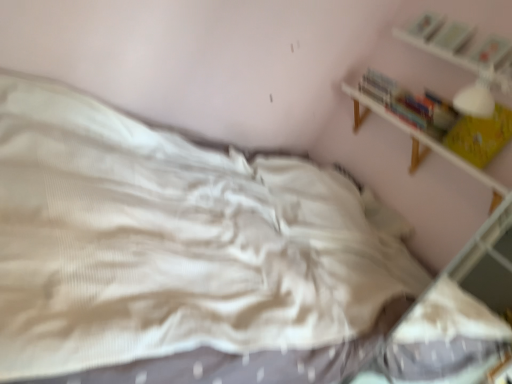
Question: From a real-world perspective, is yellow paper book at upper right, which is the fourth book in top-to-bottom order, under hardcover book at upper right, the second book when ordered from top to bottom?

Choices:
 (A) no
 (B) yes

Answer: (B)

Question: Is yellow paper book at upper right, positioned as the first book in bottom-to-top order, aimed at hardcover book at upper right, acting as the third book starting from the bottom?

Choices:
 (A) yes
 (B) no

Answer: (B)

Question: Is yellow paper book at upper right, positioned as the first book in bottom-to-top order, looking in the opposite direction of hardcover book at upper right, the second book when ordered from top to bottom?

Choices:
 (A) yes
 (B) no

Answer: (B)

Question: Is the depth of yellow paper book at upper right, which is the fourth book in top-to-bottom order, less than that of hardcover book at upper right, the second book when ordered from top to bottom?

Choices:
 (A) no
 (B) yes

Answer: (B)

Question: Is yellow paper book at upper right, which is the fourth book in top-to-bottom order, shorter than hardcover book at upper right, acting as the third book starting from the bottom?

Choices:
 (A) no
 (B) yes

Answer: (A)

Question: Relative to hardcover book at upper right, the second book when ordered from top to bottom, is hardcover book at upper right, positioned as the first book in top-to-bottom order, in front or behind?

Choices:
 (A) front
 (B) behind

Answer: (B)

Question: Is hardcover book at upper right, positioned as the first book in top-to-bottom order, bigger or smaller than hardcover book at upper right, acting as the third book starting from the bottom?

Choices:
 (A) small
 (B) big

Answer: (B)

Question: From the image's perspective, is hardcover book at upper right, positioned as the first book in top-to-bottom order, positioned above or below hardcover book at upper right, the second book when ordered from top to bottom?

Choices:
 (A) below
 (B) above

Answer: (B)

Question: Is hardcover book at upper right, positioned as the first book in top-to-bottom order, situated inside hardcover book at upper right, the second book when ordered from top to bottom, or outside?

Choices:
 (A) inside
 (B) outside

Answer: (B)

Question: Looking at their shapes, would you say hardcover book at upper right, the second book when ordered from top to bottom, is wider or thinner than hardcover book at upper right, which is counted as the 3th book, starting from the top?

Choices:
 (A) thin
 (B) wide

Answer: (B)

Question: Considering the positions of point (448, 31) and point (503, 49), is point (448, 31) closer or farther from the camera than point (503, 49)?

Choices:
 (A) farther
 (B) closer

Answer: (A)

Question: Looking at the image, does hardcover book at upper right, acting as the third book starting from the bottom, seem bigger or smaller compared to hardcover book at upper right, which is counted as the 3th book, starting from the top?

Choices:
 (A) big
 (B) small

Answer: (A)

Question: From the image's perspective, is hardcover book at upper right, acting as the third book starting from the bottom, above or below hardcover book at upper right, which is the 2th book from bottom to top?

Choices:
 (A) below
 (B) above

Answer: (B)

Question: Based on their positions, is white wooden shelf at upper right located to the left or right of yellow paper book at upper right, which is the fourth book in top-to-bottom order?

Choices:
 (A) left
 (B) right

Answer: (A)

Question: From their relative heights in the image, would you say white wooden shelf at upper right is taller or shorter than yellow paper book at upper right, which is the fourth book in top-to-bottom order?

Choices:
 (A) short
 (B) tall

Answer: (A)